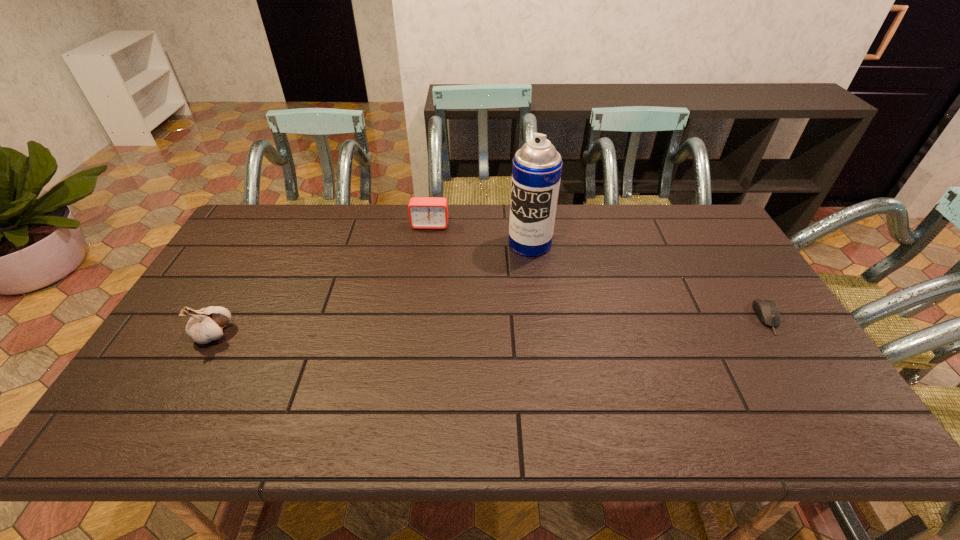
At what (x,y) coordinates should I click in order to perform the action: click on free area in between the farthest object and the shortest object. Please return your answer as a coordinate pair (x, y). This screenshot has height=540, width=960. Looking at the image, I should click on (599, 271).

Find the location of a particular element. Image resolution: width=960 pixels, height=540 pixels. empty location between the farthest object and the third shortest object is located at coordinates pos(322,280).

The width and height of the screenshot is (960, 540). Identify the location of free area in between the third tallest object and the computer mouse. (599, 271).

Select which object appears as the closest to the second farthest object. Please provide its 2D coordinates. Your answer should be formatted as a tuple, i.e. [(x, y)], where the tuple contains the x and y coordinates of a point satisfying the conditions above.

[(424, 212)]

The image size is (960, 540). I want to click on object that stands as the second closest to the farthest object, so click(x=206, y=324).

This screenshot has height=540, width=960. Identify the location of free space that satisfies the following two spatial constraints: 1. on the back side of the leftmost object; 2. on the right side of the shortest object. (222, 318).

The width and height of the screenshot is (960, 540). What are the coordinates of `free location that satisfies the following two spatial constraints: 1. on the front side of the alarm clock; 2. on the right side of the second farthest object` in the screenshot? It's located at (427, 244).